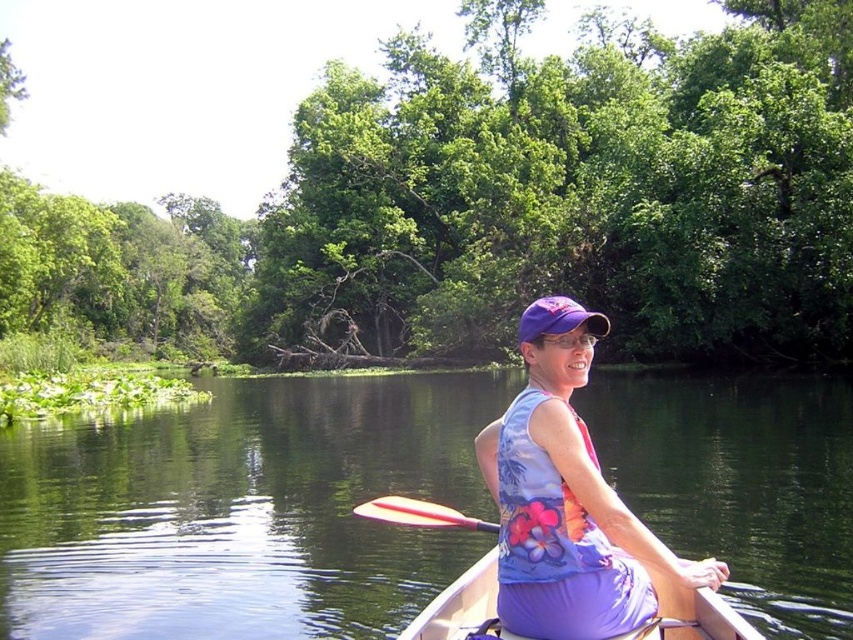
Which is in front, point (448, 384) or point (608, 490)?

Point (608, 490)

Is green smooth water at center smaller than purple fabric tank top at center?

Incorrect, green smooth water at center is not smaller in size than purple fabric tank top at center.

Which is in front, point (10, 541) or point (486, 481)?

Point (486, 481) is in front.

Find the location of `green smooth water at center`. green smooth water at center is located at coordinates (242, 509).

Can you confirm if green smooth water at center is shorter than white plastic canoe at center?

No.

Between point (42, 442) and point (447, 632), which one is positioned in front?

Point (447, 632) is more forward.

At what (x,y) coordinates should I click in order to perform the action: click on green smooth water at center. Please return your answer as a coordinate pair (x, y). Image resolution: width=853 pixels, height=640 pixels. Looking at the image, I should click on (242, 509).

Who is lower down, white plastic canoe at center or pink rubber paddle at center?

pink rubber paddle at center

The width and height of the screenshot is (853, 640). What are the coordinates of `white plastic canoe at center` in the screenshot? It's located at (462, 605).